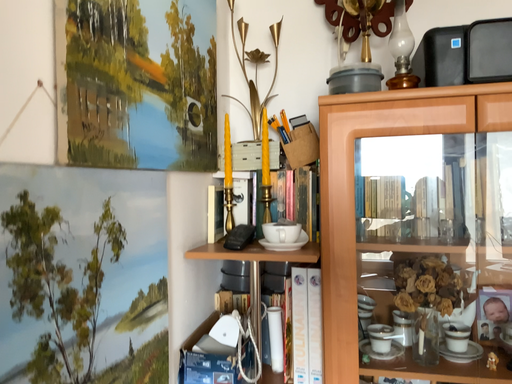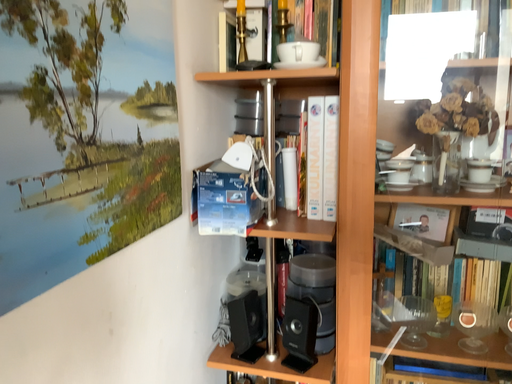
Question: How did the camera likely rotate when shooting the video?

Choices:
 (A) rotated upward
 (B) rotated downward

Answer: (B)